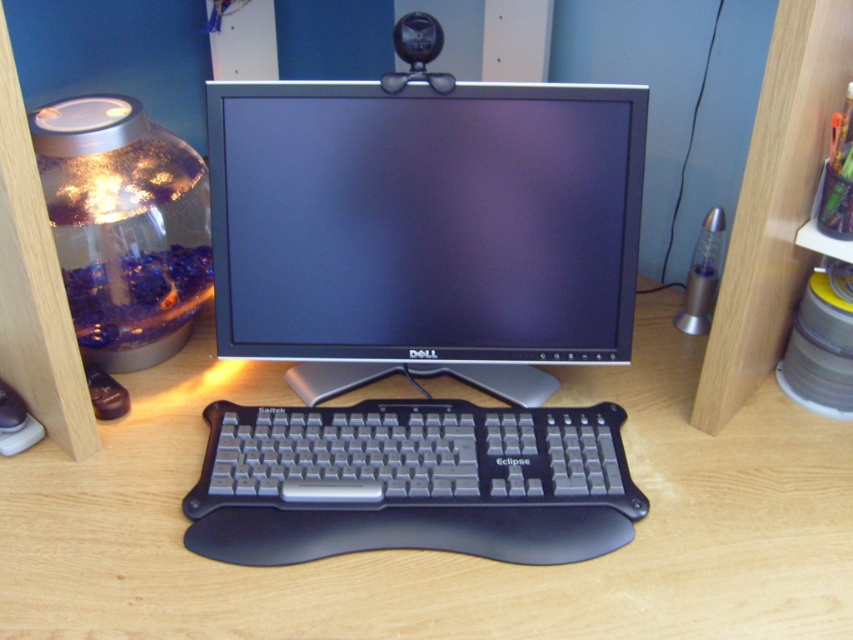
Who is higher up, satin black monitor at center or satin black keyboard at center?

satin black monitor at center is higher up.

Is satin black monitor at center to the left of satin black keyboard at center from the viewer's perspective?

Incorrect, satin black monitor at center is not on the left side of satin black keyboard at center.

Locate an element on the screen. The width and height of the screenshot is (853, 640). satin black monitor at center is located at coordinates point(425,228).

Is black plastic keyboard at center closer to the viewer compared to satin black monitor at center?

Yes, black plastic keyboard at center is closer to the viewer.

Can you confirm if black plastic keyboard at center is taller than satin black monitor at center?

Incorrect, black plastic keyboard at center's height is not larger of satin black monitor at center's.

Between point (286, 573) and point (419, 220), which one is positioned in front?

Point (286, 573) is more forward.

You are a GUI agent. You are given a task and a screenshot of the screen. Output one action in this format:
    pyautogui.click(x=<x>, y=<y>)
    Task: Click on the black plastic keyboard at center
    
    Given the screenshot: What is the action you would take?
    pyautogui.click(x=437, y=552)

Can you confirm if black plastic keyboard at center is smaller than satin black keyboard at center?

No.

Does black plastic keyboard at center have a greater width compared to satin black keyboard at center?

Indeed, black plastic keyboard at center has a greater width compared to satin black keyboard at center.

Is point (726, 481) more distant than point (474, 525)?

Yes.

Where is `black plastic keyboard at center`? This screenshot has height=640, width=853. black plastic keyboard at center is located at coordinates (437, 552).